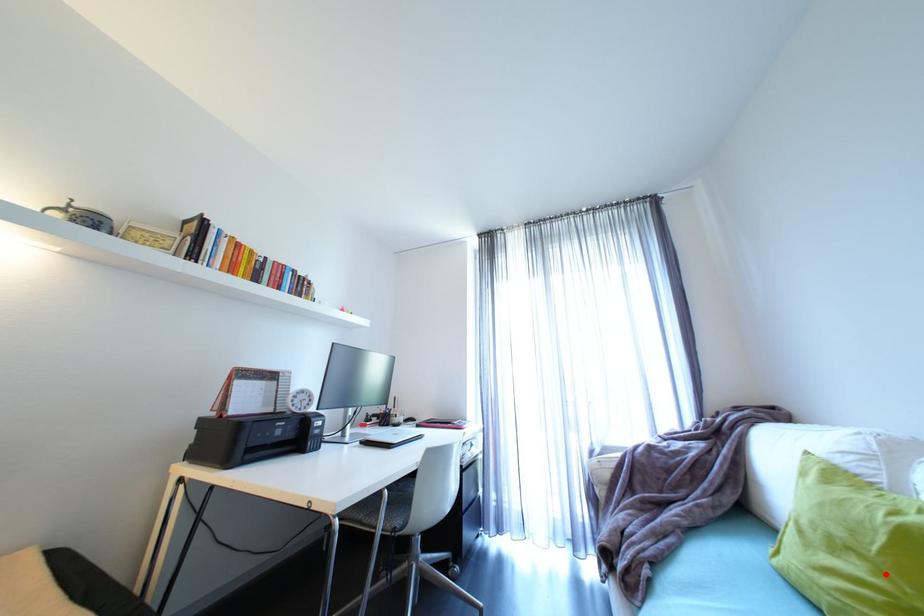
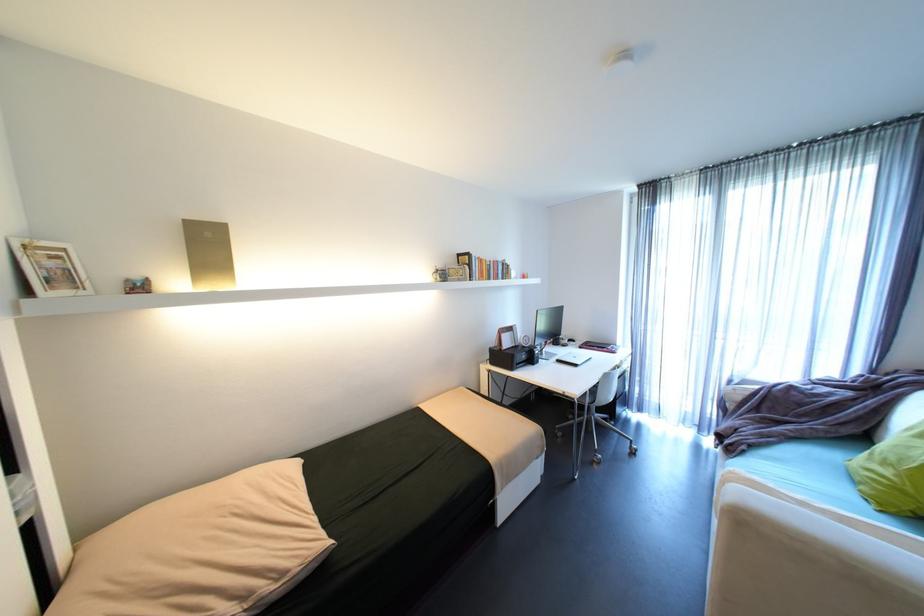
Question: I am providing you with two images of the same scene from different viewpoints. A red point is shown in image1. For the corresponding object point in image2, is it positioned nearer or farther from the camera?

Choices:
 (A) Nearer
 (B) Farther

Answer: (B)